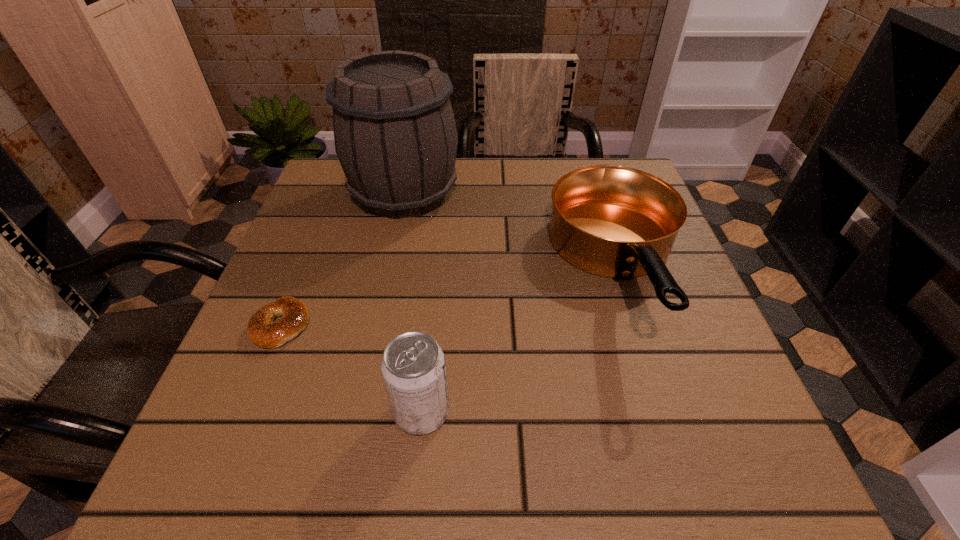
Identify the location of object that is at the near edge. This screenshot has width=960, height=540. (413, 368).

Find the location of a particular element. The height and width of the screenshot is (540, 960). wine bucket that is at the left edge is located at coordinates pyautogui.click(x=395, y=135).

Find the location of `bagel located at the left edge`. bagel located at the left edge is located at coordinates (261, 330).

The image size is (960, 540). I want to click on object at the right edge, so click(x=613, y=221).

Where is `object at the far left corner`? This screenshot has height=540, width=960. object at the far left corner is located at coordinates point(395,135).

Locate an element on the screen. This screenshot has height=540, width=960. object located in the far right corner section of the desktop is located at coordinates (613, 221).

Image resolution: width=960 pixels, height=540 pixels. I want to click on vacant area at the far edge, so click(568, 163).

Image resolution: width=960 pixels, height=540 pixels. I want to click on vacant region at the near edge of the desktop, so click(x=368, y=484).

Find the location of `vacant space at the left edge of the desktop`. vacant space at the left edge of the desktop is located at coordinates [350, 224].

Where is `vacant space at the right edge of the desktop`? vacant space at the right edge of the desktop is located at coordinates (693, 415).